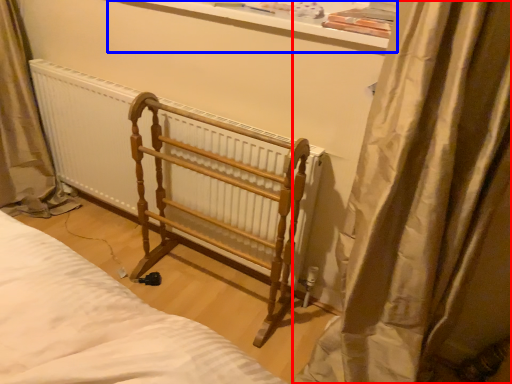
Question: Which object is closer to the camera taking this photo, curtain (highlighted by a red box) or window sill (highlighted by a blue box)?

Choices:
 (A) curtain
 (B) window sill

Answer: (A)